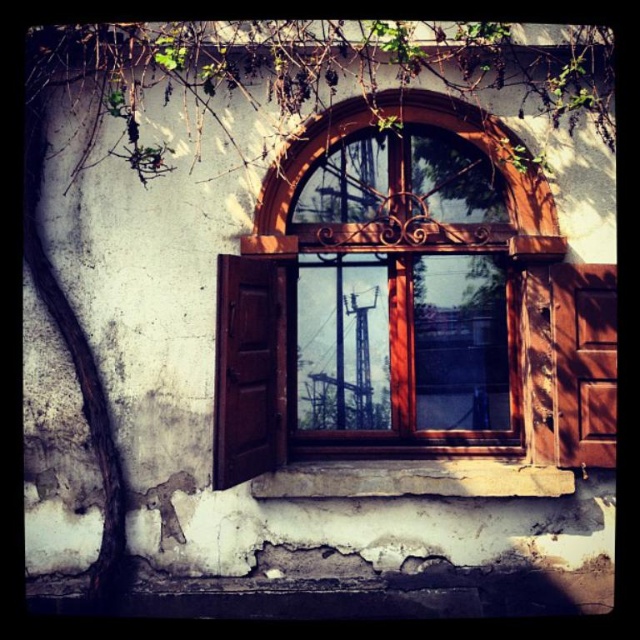
You are standing in front of the rustic window and notice two points marked on the wall. The first point is at coordinates point (x=433, y=320) and the second is at point (x=490, y=492). Which point is closer to you?

Point (x=490, y=492) is closer to you because it is less further to the camera than point (x=433, y=320).

You are a painter standing 10 feet away from the wooden window at center and the green leafy vine at upper center. You want to paint both objects in one stroke without moving your arm. Can you do it? Explain your reasoning.

The wooden window at center is 32.11 inches from the green leafy vine at upper center. Since you are standing 10 feet away, the distance between the two objects is within a reasonable range for a painter to paint both in one stroke without moving their arm.

You are standing in front of the rustic window with closed shutters. You want to take a photo of the point marked at coordinate point (544, 221) in the window frame. If your camera is 6.25 meters away from the point, can you capture the entire rustic window in one shot without moving the camera?

The point marked at coordinate point (544, 221) is 6.25 meters away from the camera. Since the camera is positioned at this distance, it is possible to capture the entire rustic window in one shot without moving the camera, provided the camera lens has an appropriate wide enough angle to encompass the window frame.